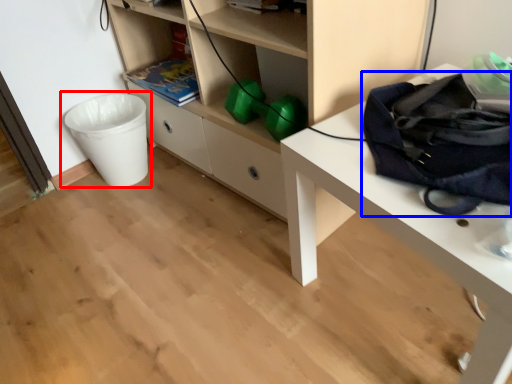
Question: Which of the following is the closest to the observer, waste container (highlighted by a red box) or messenger bag (highlighted by a blue box)?

Choices:
 (A) waste container
 (B) messenger bag

Answer: (B)